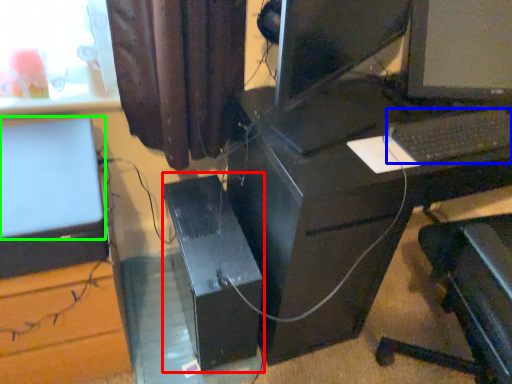
Question: Which is farther away from computer tower (highlighted by a red box)? computer keyboard (highlighted by a blue box) or computer monitor (highlighted by a green box)?

Choices:
 (A) computer keyboard
 (B) computer monitor

Answer: (A)